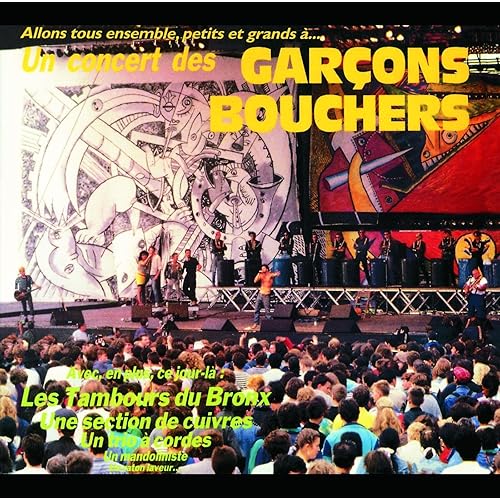
Where is `paintings`? The height and width of the screenshot is (500, 500). paintings is located at coordinates (431, 164), (142, 170).